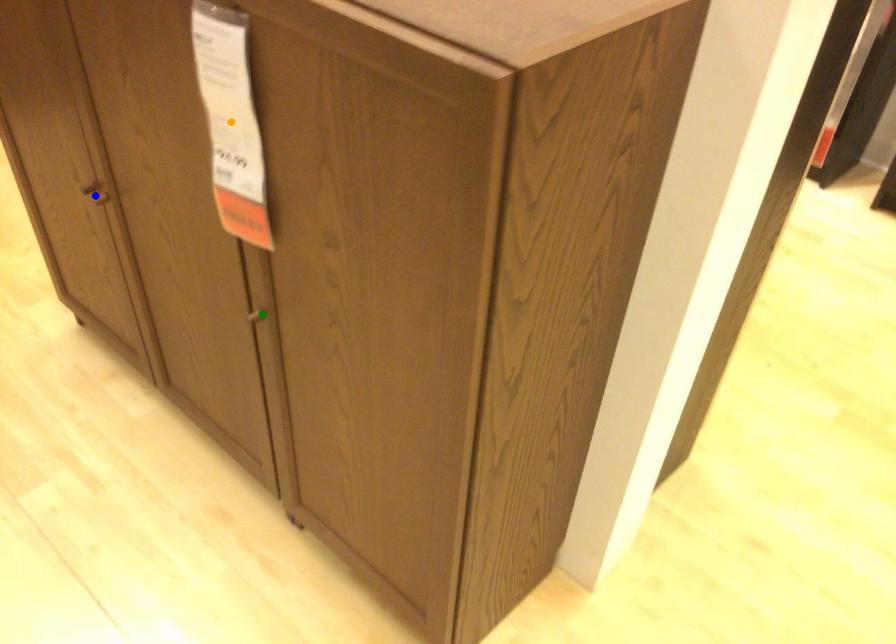
Order these from farthest to nearest:
orange point
green point
blue point

blue point
green point
orange point